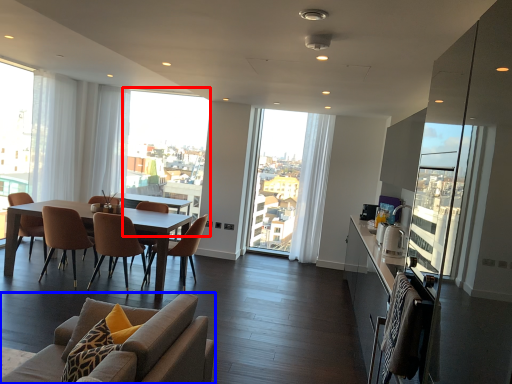
Question: Which point is further to the camera, window screen (highlighted by a red box) or chair (highlighted by a blue box)?

Choices:
 (A) window screen
 (B) chair

Answer: (A)